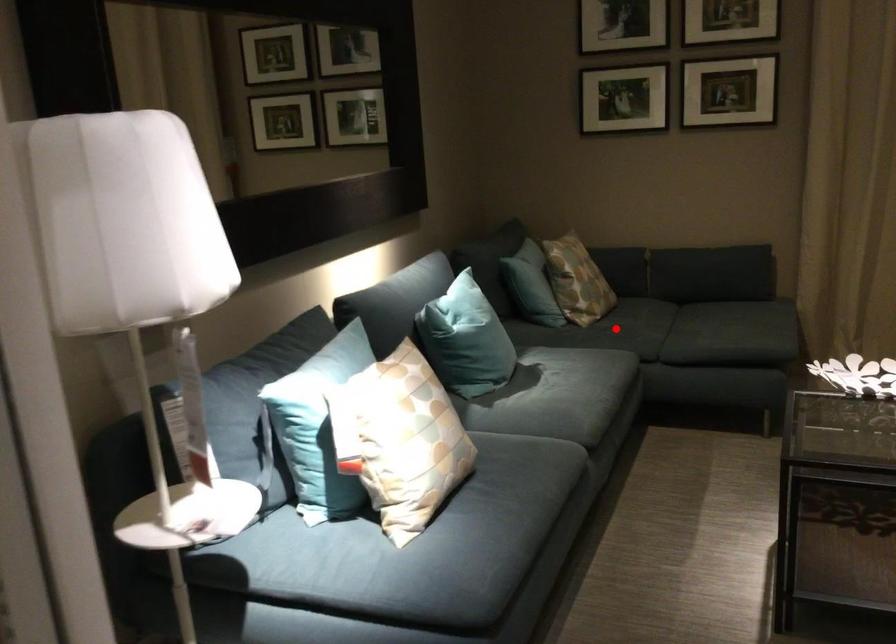
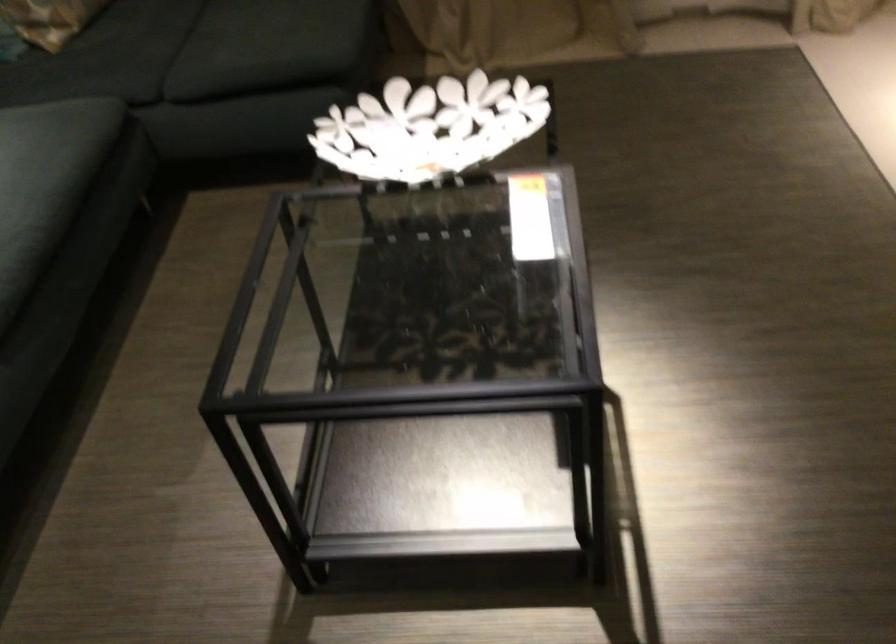
Locate, in the second image, the point that corresponds to the highlighted location in the first image.

(85, 73)